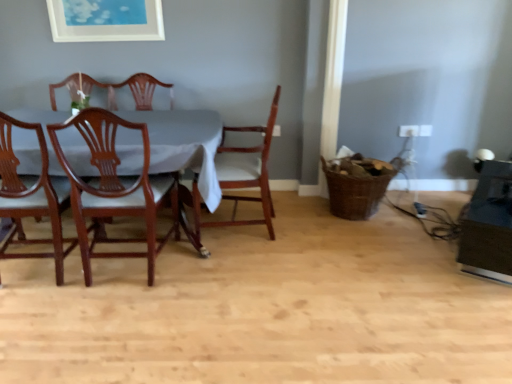
Question: Can you confirm if mahogany wood chair at left, placed as the first chair when sorted from left to right, is taller than brown woven basket at lower right?

Choices:
 (A) no
 (B) yes

Answer: (B)

Question: Does mahogany wood chair at left, which ranks as the third chair in right-to-left order, appear on the right side of brown woven basket at lower right?

Choices:
 (A) no
 (B) yes

Answer: (A)

Question: Does mahogany wood chair at left, which ranks as the third chair in right-to-left order, have a smaller size compared to brown woven basket at lower right?

Choices:
 (A) yes
 (B) no

Answer: (B)

Question: Would you say mahogany wood chair at left, which ranks as the third chair in right-to-left order, contains brown woven basket at lower right?

Choices:
 (A) no
 (B) yes

Answer: (A)

Question: Does mahogany wood chair at left, placed as the first chair when sorted from left to right, have a lesser height compared to brown woven basket at lower right?

Choices:
 (A) no
 (B) yes

Answer: (A)

Question: Is mahogany wood chair at left, placed as the first chair when sorted from left to right, further to the viewer compared to brown woven basket at lower right?

Choices:
 (A) no
 (B) yes

Answer: (A)

Question: Would you say white matte picture frame at upper center is outside mahogany wood chair at left, placed as the first chair when sorted from left to right?

Choices:
 (A) no
 (B) yes

Answer: (B)

Question: Considering the relative sizes of white matte picture frame at upper center and mahogany wood chair at left, which ranks as the third chair in right-to-left order, in the image provided, is white matte picture frame at upper center taller than mahogany wood chair at left, which ranks as the third chair in right-to-left order,?

Choices:
 (A) no
 (B) yes

Answer: (A)

Question: From the image's perspective, does white matte picture frame at upper center appear higher than mahogany wood chair at left, which ranks as the third chair in right-to-left order?

Choices:
 (A) no
 (B) yes

Answer: (B)

Question: Is white matte picture frame at upper center positioned far away from mahogany wood chair at left, which ranks as the third chair in right-to-left order?

Choices:
 (A) yes
 (B) no

Answer: (A)

Question: From a real-world perspective, is white matte picture frame at upper center located beneath mahogany wood chair at left, placed as the first chair when sorted from left to right?

Choices:
 (A) yes
 (B) no

Answer: (B)

Question: From the image's perspective, is white matte picture frame at upper center beneath mahogany wood chair at left, which ranks as the third chair in right-to-left order?

Choices:
 (A) yes
 (B) no

Answer: (B)

Question: Is mahogany wood chair at left, placed as the first chair when sorted from left to right, turned away from white matte picture frame at upper center?

Choices:
 (A) yes
 (B) no

Answer: (B)